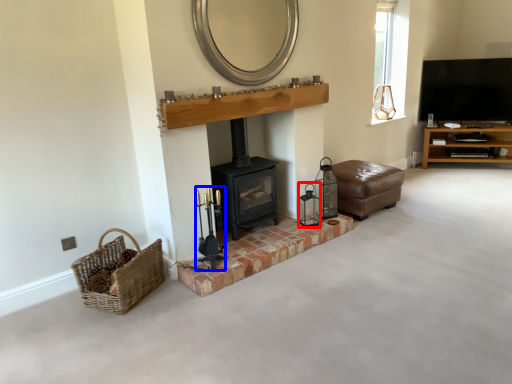
Question: Which of the following is the closest to the observer, candle holder (highlighted by a red box) or candle holder (highlighted by a blue box)?

Choices:
 (A) candle holder
 (B) candle holder

Answer: (B)